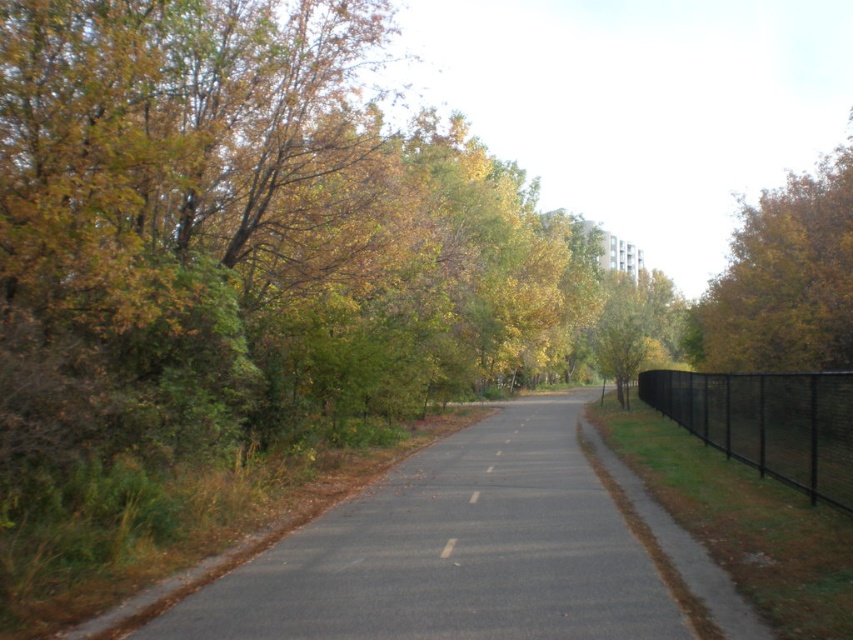
In the scene shown: Is black chain-link fence at right above white paper at center?

Yes, black chain-link fence at right is above white paper at center.

This screenshot has width=853, height=640. Describe the element at coordinates (767, 422) in the screenshot. I see `black chain-link fence at right` at that location.

Is point (788, 412) closer to viewer compared to point (442, 556)?

No.

Where is `black chain-link fence at right`? Image resolution: width=853 pixels, height=640 pixels. black chain-link fence at right is located at coordinates (767, 422).

Who is more forward, (x=448, y=472) or (x=450, y=548)?

Point (x=450, y=548) is in front.

Is point (593, 550) more distant than point (442, 550)?

No, it is in front of (442, 550).

The height and width of the screenshot is (640, 853). I want to click on asphalt road at center, so click(x=453, y=552).

How much distance is there between yellow-green foliage at upper right and white paper at center?

The distance of yellow-green foliage at upper right from white paper at center is 37.05 meters.

Does yellow-green foliage at upper right have a lesser width compared to white paper at center?

No.

You are a GUI agent. You are given a task and a screenshot of the screen. Output one action in this format:
    pyautogui.click(x=<x>, y=<y>)
    Task: Click on the yellow-green foliage at upper right
    
    Given the screenshot: What is the action you would take?
    pyautogui.click(x=782, y=280)